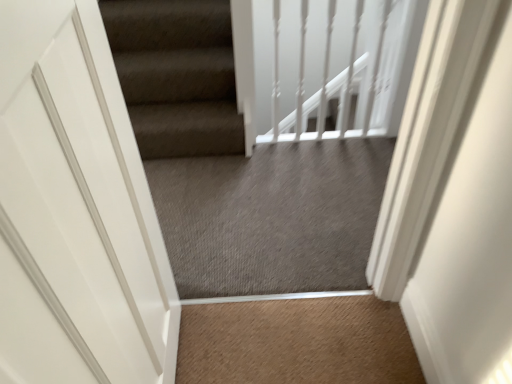
Question: Can you confirm if white matte door at left is positioned to the right of gray carpet at center?

Choices:
 (A) no
 (B) yes

Answer: (A)

Question: Is white matte door at left surrounding gray carpet at center?

Choices:
 (A) no
 (B) yes

Answer: (A)

Question: From a real-world perspective, is white matte door at left on top of gray carpet at center?

Choices:
 (A) no
 (B) yes

Answer: (B)

Question: Can you confirm if white matte door at left is thinner than gray carpet at center?

Choices:
 (A) yes
 (B) no

Answer: (B)

Question: From the image's perspective, is white matte door at left on gray carpet at center?

Choices:
 (A) no
 (B) yes

Answer: (A)

Question: From a real-world perspective, is white matte door at left located beneath gray carpet at center?

Choices:
 (A) yes
 (B) no

Answer: (B)

Question: Is white matte door at left not within white glossy balustrade at upper center?

Choices:
 (A) no
 (B) yes

Answer: (B)

Question: Could you tell me if white matte door at left is facing white glossy balustrade at upper center?

Choices:
 (A) yes
 (B) no

Answer: (B)

Question: Considering the relative sizes of white matte door at left and white glossy balustrade at upper center in the image provided, is white matte door at left bigger than white glossy balustrade at upper center?

Choices:
 (A) yes
 (B) no

Answer: (A)

Question: Would you consider white matte door at left to be distant from white glossy balustrade at upper center?

Choices:
 (A) no
 (B) yes

Answer: (B)

Question: From a real-world perspective, is white matte door at left below white glossy balustrade at upper center?

Choices:
 (A) no
 (B) yes

Answer: (A)

Question: Is white matte door at left taller than white glossy balustrade at upper center?

Choices:
 (A) yes
 (B) no

Answer: (A)

Question: Is the surface of white glossy balustrade at upper center in direct contact with white matte door at left?

Choices:
 (A) yes
 (B) no

Answer: (B)